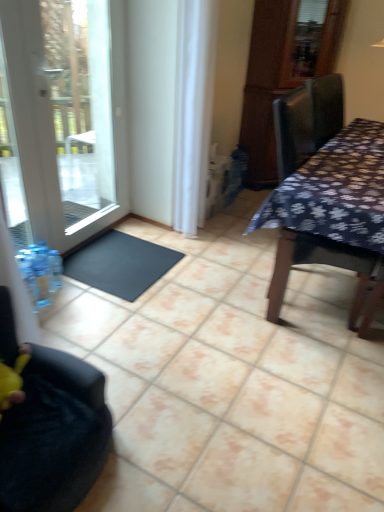
Question: Are dark floral fabric table at right and black rubber doormat at lower left far apart?

Choices:
 (A) yes
 (B) no

Answer: (A)

Question: Does dark floral fabric table at right come in front of black rubber doormat at lower left?

Choices:
 (A) no
 (B) yes

Answer: (B)

Question: Is dark floral fabric table at right further to camera compared to black rubber doormat at lower left?

Choices:
 (A) yes
 (B) no

Answer: (B)

Question: From a real-world perspective, is dark floral fabric table at right physically below black rubber doormat at lower left?

Choices:
 (A) no
 (B) yes

Answer: (A)

Question: Could you tell me if dark floral fabric table at right is facing black rubber doormat at lower left?

Choices:
 (A) no
 (B) yes

Answer: (A)

Question: Considering the positions of black rubber doormat at lower left and white sheer curtain at center in the image, is black rubber doormat at lower left wider or thinner than white sheer curtain at center?

Choices:
 (A) wide
 (B) thin

Answer: (A)

Question: Considering the positions of point (114, 273) and point (185, 202), is point (114, 273) closer or farther from the camera than point (185, 202)?

Choices:
 (A) farther
 (B) closer

Answer: (B)

Question: Relative to white sheer curtain at center, is black rubber doormat at lower left in front or behind?

Choices:
 (A) front
 (B) behind

Answer: (B)

Question: Looking at the image, does black rubber doormat at lower left seem bigger or smaller compared to white sheer curtain at center?

Choices:
 (A) big
 (B) small

Answer: (B)

Question: Considering their positions, is black fabric chair at lower left located in front of or behind white sheer curtain at center?

Choices:
 (A) front
 (B) behind

Answer: (A)

Question: Considering the positions of black fabric chair at lower left and white sheer curtain at center in the image, is black fabric chair at lower left bigger or smaller than white sheer curtain at center?

Choices:
 (A) big
 (B) small

Answer: (A)

Question: From the image's perspective, is black fabric chair at lower left positioned above or below white sheer curtain at center?

Choices:
 (A) below
 (B) above

Answer: (A)

Question: Would you say black fabric chair at lower left is inside or outside white sheer curtain at center?

Choices:
 (A) inside
 (B) outside

Answer: (B)

Question: From a real-world perspective, relative to black rubber doormat at lower left, is white glass door at left vertically above or below?

Choices:
 (A) below
 (B) above

Answer: (B)

Question: Based on their sizes in the image, would you say white glass door at left is bigger or smaller than black rubber doormat at lower left?

Choices:
 (A) small
 (B) big

Answer: (B)